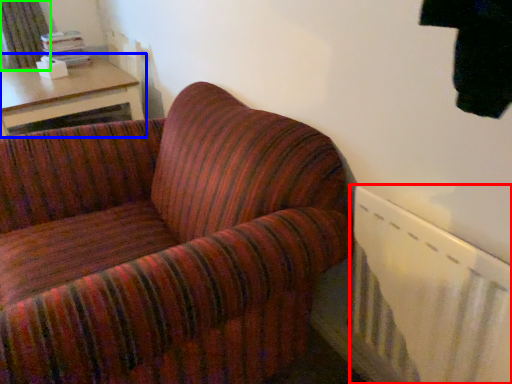
Question: Which is farther away from radiator (highlighted by a red box)? table (highlighted by a blue box) or curtain (highlighted by a green box)?

Choices:
 (A) table
 (B) curtain

Answer: (B)